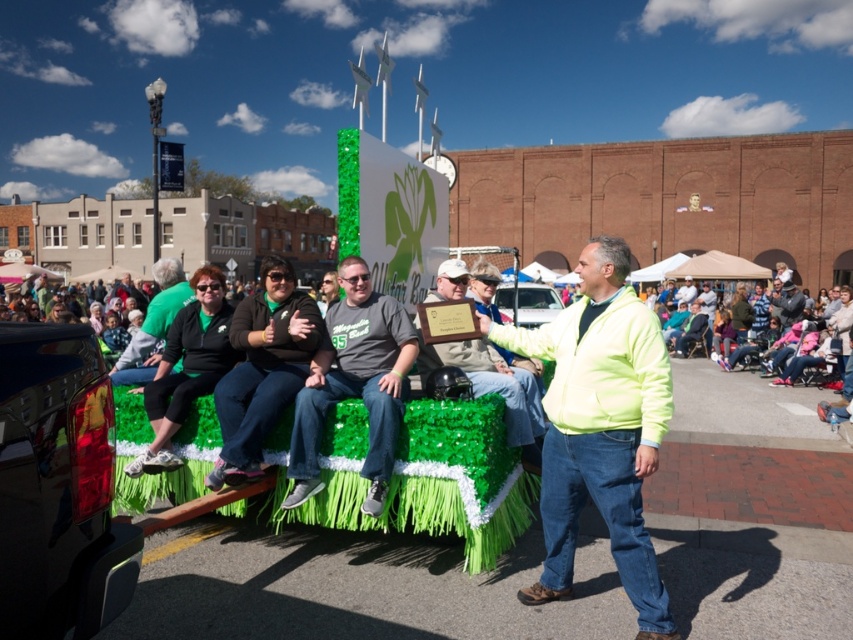
Question: Which point is farther from the camera taking this photo?

Choices:
 (A) (161, 262)
 (B) (532, 426)
 (C) (312, 492)
 (D) (245, 324)

Answer: (A)

Question: Can you confirm if neon yellow jacket at center is positioned below matte green helmet at center?

Choices:
 (A) yes
 (B) no

Answer: (A)

Question: Does matte green fabric at center come behind matte green shirt at center?

Choices:
 (A) no
 (B) yes

Answer: (A)

Question: Which object is positioned closest to the neon yellow jacket at center?

Choices:
 (A) matte green fabric at center
 (B) matte gray shirt at center
 (C) matte green helmet at center

Answer: (C)

Question: Does neon yellow jacket at center have a larger size compared to matte green fabric at center?

Choices:
 (A) no
 (B) yes

Answer: (B)

Question: Among these points, which one is nearest to the camera?

Choices:
 (A) (233, 346)
 (B) (476, 346)
 (C) (312, 362)

Answer: (A)